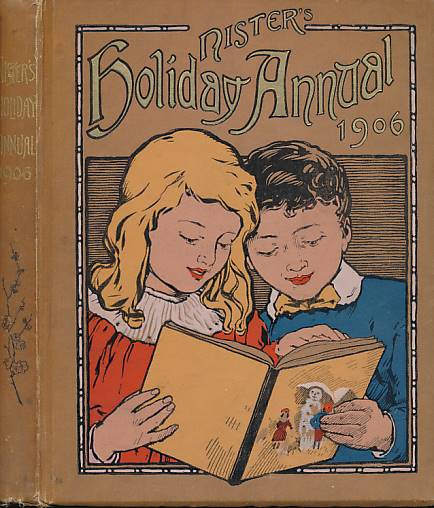
Locate an element on the screen. spine of book is located at coordinates (262, 394).